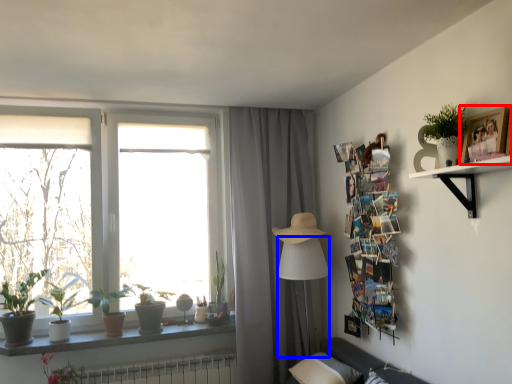
Question: Among these objects, which one is nearest to the camera, picture frame (highlighted by a red box) or table lamp (highlighted by a blue box)?

Choices:
 (A) picture frame
 (B) table lamp

Answer: (A)